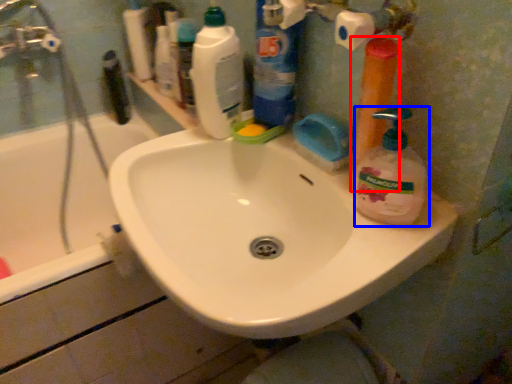
Question: Which object appears farthest to the camera in this image, cleaning product (highlighted by a red box) or cleaning product (highlighted by a blue box)?

Choices:
 (A) cleaning product
 (B) cleaning product

Answer: (A)